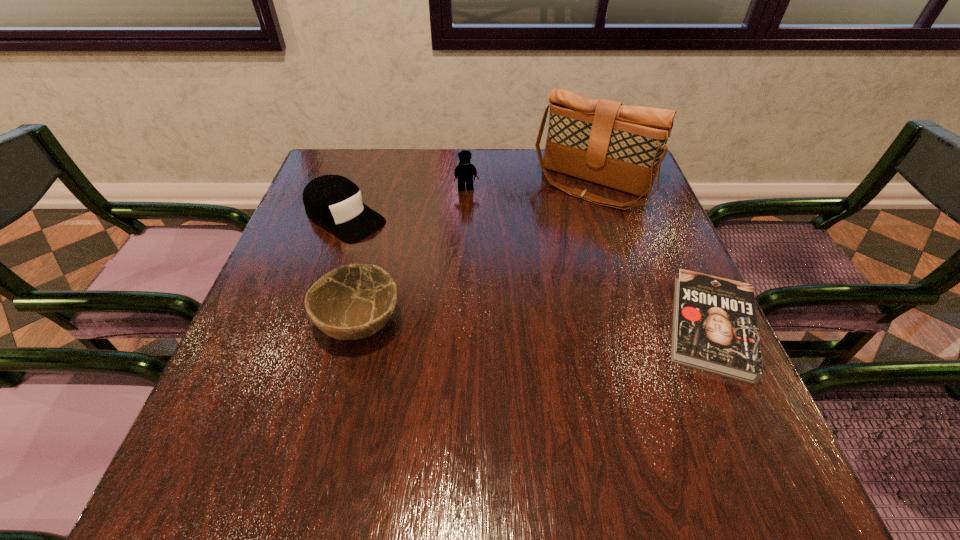
This screenshot has width=960, height=540. Find the location of `vacant region located 0.280m on the front-facing side of the fourth shortest object`. vacant region located 0.280m on the front-facing side of the fourth shortest object is located at coordinates (486, 268).

Identify the location of blank space located on the front-facing side of the shoulder bag. (498, 310).

Locate an element on the screen. This screenshot has width=960, height=540. vacant area situated on the front-facing side of the shoulder bag is located at coordinates (553, 233).

Find the location of `free location located on the front-facing side of the shoulder bag`. free location located on the front-facing side of the shoulder bag is located at coordinates (512, 292).

I want to click on free space located on the front-facing side of the cap, so click(x=413, y=260).

Identify the location of vacant area situated 0.390m on the front-facing side of the cap. The width and height of the screenshot is (960, 540). (499, 316).

At what (x,y) coordinates should I click in order to perform the action: click on vacant space located 0.110m on the front-facing side of the cap. Please return your answer as a coordinate pair (x, y). The image size is (960, 540). Looking at the image, I should click on point(404,255).

I want to click on Lego situated at the far edge, so click(464, 172).

This screenshot has height=540, width=960. In order to click on shoulder bag positioned at the far edge in this screenshot , I will do `click(601, 141)`.

Locate an element on the screen. This screenshot has width=960, height=540. cap at the far edge is located at coordinates (334, 202).